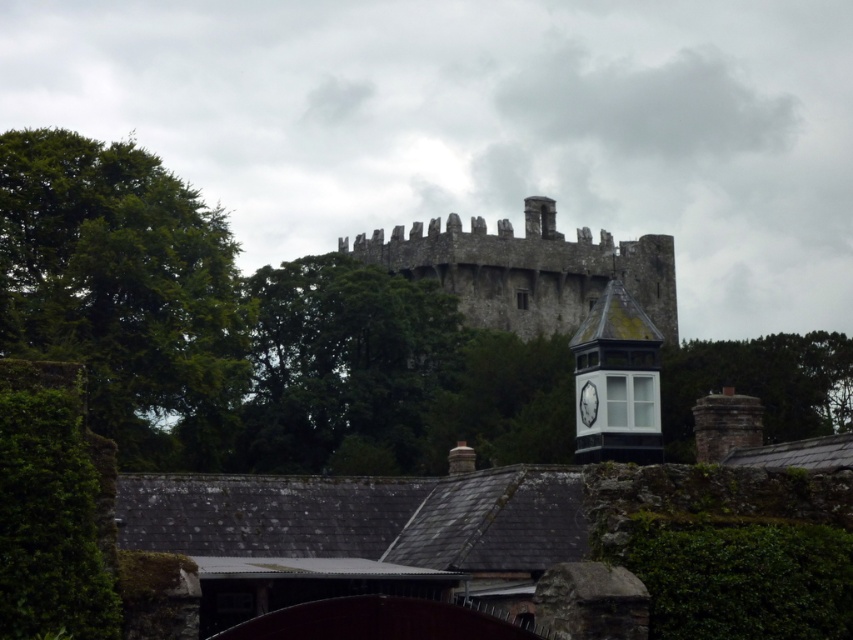
Which is above, dark gray stone castle at center or green leafy tree at right?

dark gray stone castle at center is higher up.

Who is positioned more to the left, dark gray stone castle at center or green leafy tree at right?

dark gray stone castle at center is more to the left.

Between point (541, 241) and point (772, 356), which one is positioned behind?

Point (541, 241)

Locate an element on the screen. This screenshot has width=853, height=640. dark gray stone castle at center is located at coordinates (527, 269).

Is point (596, 262) less distant than point (582, 419)?

That is False.

How distant is dark gray stone castle at center from white glossy clock at upper center?

dark gray stone castle at center and white glossy clock at upper center are 99.63 meters apart from each other.

Image resolution: width=853 pixels, height=640 pixels. Describe the element at coordinates (527, 269) in the screenshot. I see `dark gray stone castle at center` at that location.

Where is `dark gray stone castle at center`? dark gray stone castle at center is located at coordinates (527, 269).

Can you confirm if dark gray stone castle at center is smaller than white glass clock tower at upper center?

No, dark gray stone castle at center is not smaller than white glass clock tower at upper center.

Which is in front, point (529, 221) or point (653, 339)?

Point (653, 339) is in front.

Who is more forward, (647, 259) or (641, 394)?

Point (641, 394) is more forward.

The width and height of the screenshot is (853, 640). Identify the location of dark gray stone castle at center. (527, 269).